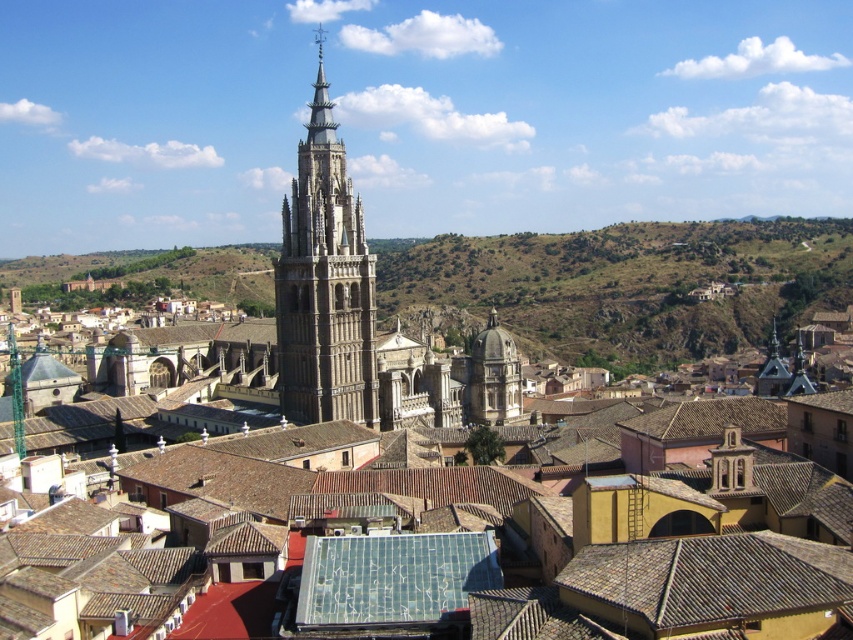
Question: Which object is closer to the camera taking this photo?

Choices:
 (A) brown tile roof at lower right
 (B) stone gothic tower at center
 (C) smooth gray dome at center
 (D) brown rocky hillside at center

Answer: (A)

Question: Can you confirm if stone gothic tower at center is bigger than smooth gray dome at center?

Choices:
 (A) no
 (B) yes

Answer: (B)

Question: Which object is positioned farthest from the stone gothic tower at center?

Choices:
 (A) smooth gray dome at center
 (B) brown rocky hillside at center

Answer: (B)

Question: Is brown rocky hillside at center behind stone gothic tower at center?

Choices:
 (A) yes
 (B) no

Answer: (A)

Question: Is brown tile roof at lower right closer to camera compared to smooth gray dome at center?

Choices:
 (A) yes
 (B) no

Answer: (A)

Question: Which object appears closest to the camera in this image?

Choices:
 (A) brown rocky hillside at center
 (B) stone gothic tower at center
 (C) smooth gray dome at center

Answer: (B)